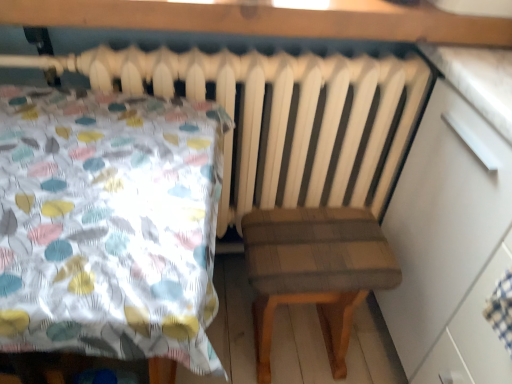
Question: Is plaid fabric stool at center at the right side of white glossy dresser at right?

Choices:
 (A) no
 (B) yes

Answer: (A)

Question: Considering the relative sizes of plaid fabric stool at center and white glossy dresser at right in the image provided, is plaid fabric stool at center taller than white glossy dresser at right?

Choices:
 (A) no
 (B) yes

Answer: (A)

Question: Is plaid fabric stool at center in contact with white glossy dresser at right?

Choices:
 (A) no
 (B) yes

Answer: (A)

Question: Can you confirm if plaid fabric stool at center is shorter than white glossy dresser at right?

Choices:
 (A) yes
 (B) no

Answer: (A)

Question: From a real-world perspective, is plaid fabric stool at center located higher than white glossy dresser at right?

Choices:
 (A) no
 (B) yes

Answer: (A)

Question: From a real-world perspective, is plaid fabric stool at center under white glossy dresser at right?

Choices:
 (A) yes
 (B) no

Answer: (A)

Question: Can you confirm if white glossy dresser at right is positioned to the left of plaid fabric stool at center?

Choices:
 (A) yes
 (B) no

Answer: (B)

Question: From a real-world perspective, is white glossy dresser at right over plaid fabric stool at center?

Choices:
 (A) no
 (B) yes

Answer: (B)

Question: Can you confirm if white glossy dresser at right is thinner than plaid fabric stool at center?

Choices:
 (A) yes
 (B) no

Answer: (B)

Question: From the image's perspective, would you say white glossy dresser at right is positioned over plaid fabric stool at center?

Choices:
 (A) no
 (B) yes

Answer: (B)

Question: Is white glossy dresser at right positioned behind plaid fabric stool at center?

Choices:
 (A) yes
 (B) no

Answer: (B)

Question: Does white glossy dresser at right have a greater height compared to plaid fabric stool at center?

Choices:
 (A) yes
 (B) no

Answer: (A)

Question: In terms of height, does plaid fabric stool at center look taller or shorter compared to white glossy dresser at right?

Choices:
 (A) tall
 (B) short

Answer: (B)